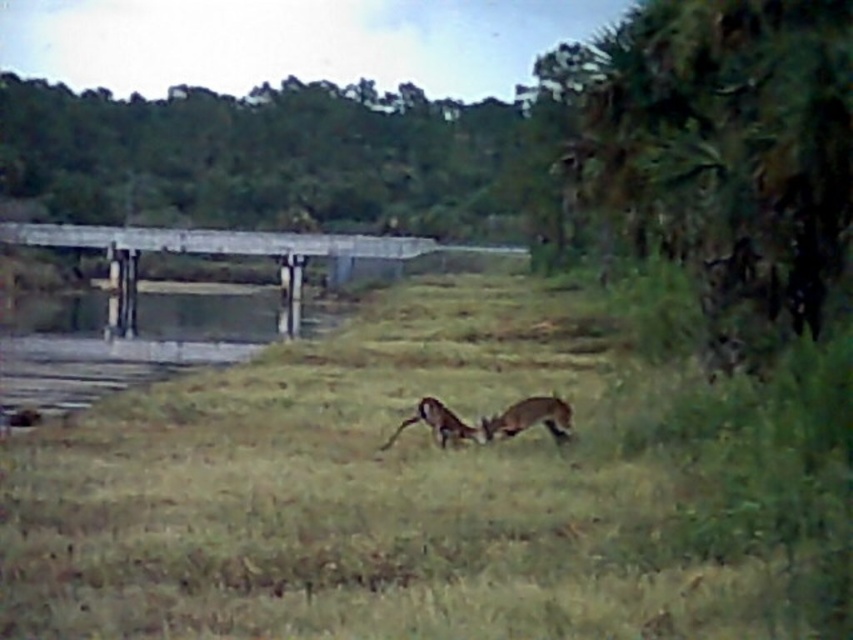
Who is positioned more to the left, clear water at bridge center or brown furry dog at center?

From the viewer's perspective, clear water at bridge center appears more on the left side.

Can you confirm if clear water at bridge center is wider than brown furry dog at center?

Yes.

Locate an element on the screen. The image size is (853, 640). clear water at bridge center is located at coordinates (207, 316).

Image resolution: width=853 pixels, height=640 pixels. Find the location of `clear water at bridge center`. clear water at bridge center is located at coordinates (207, 316).

Which is in front, point (123, 278) or point (497, 422)?

Point (497, 422) is more forward.

Locate an element on the screen. gray concrete bridge at left is located at coordinates (212, 253).

Who is higher up, clear water at bridge center or brown furry antelope at center?

Positioned higher is clear water at bridge center.

Is clear water at bridge center wider than brown furry antelope at center?

Indeed, clear water at bridge center has a greater width compared to brown furry antelope at center.

Locate an element on the screen. clear water at bridge center is located at coordinates (207, 316).